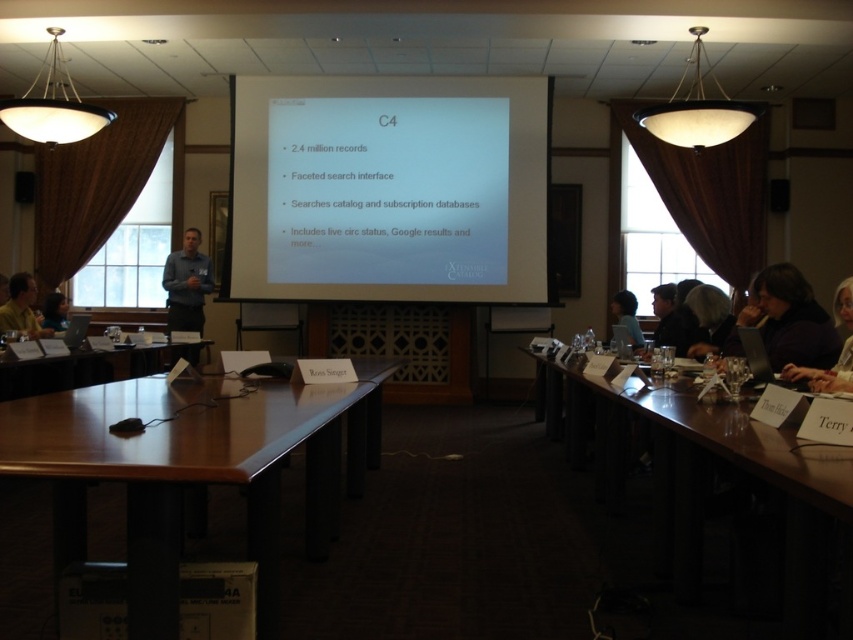
Question: Is gray shirt at center to the left of matte black hair at upper center from the viewer's perspective?

Choices:
 (A) yes
 (B) no

Answer: (A)

Question: Does gray shirt at center have a larger size compared to metallic projector at center?

Choices:
 (A) yes
 (B) no

Answer: (A)

Question: Which point is farther to the camera?

Choices:
 (A) gray shirt at center
 (B) metallic projector at center
 (C) brown wooden table at lower right
 (D) white hair at upper right

Answer: (A)

Question: Is brown wooden table at lower right below gray shirt at center?

Choices:
 (A) yes
 (B) no

Answer: (A)

Question: Which point appears closest to the camera in this image?

Choices:
 (A) (663, 339)
 (B) (695, 472)

Answer: (B)

Question: Considering the real-world distances, which object is closest to the matte black laptop at left?

Choices:
 (A) gray shirt at center
 (B) wooden table at center

Answer: (A)